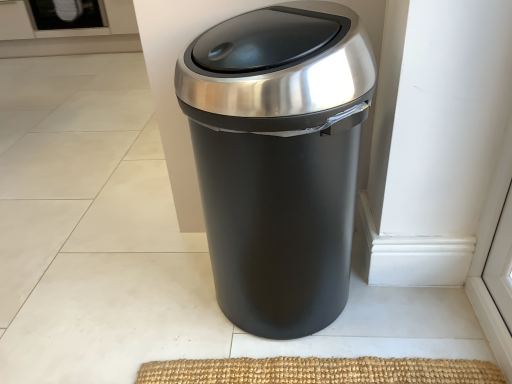
The image size is (512, 384). In order to click on vacant space situated on the left part of matte black trash can at center in this screenshot , I will do `click(149, 294)`.